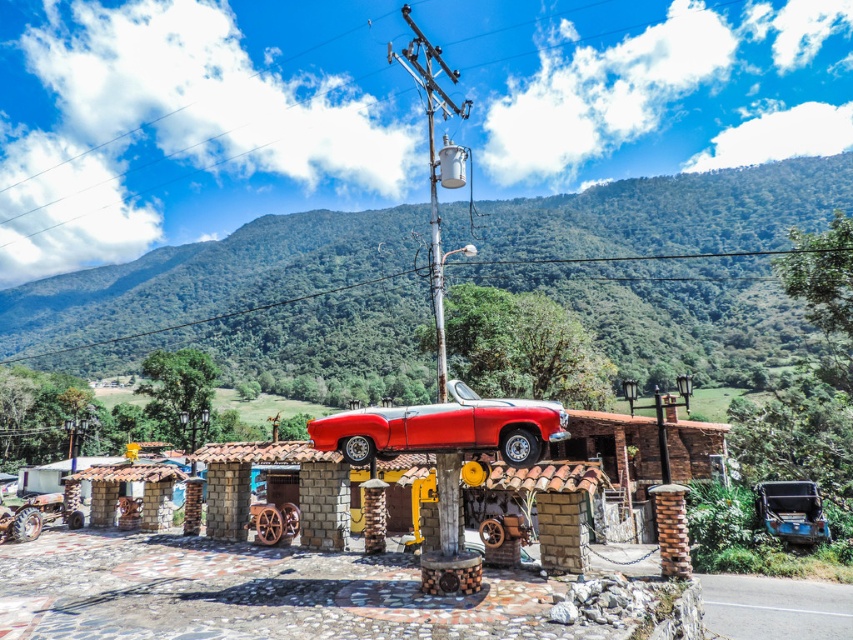
Can you confirm if metallic pole at upper center is taller than blue metallic truck at lower right?

Indeed, metallic pole at upper center has a greater height compared to blue metallic truck at lower right.

Which is below, metallic pole at upper center or blue metallic truck at lower right?

blue metallic truck at lower right is lower down.

Which is in front, point (790, 250) or point (782, 529)?

Point (782, 529) is more forward.

I want to click on metallic pole at upper center, so click(x=213, y=316).

Who is positioned more to the left, shiny red car at center or brown stone pillar at center?

shiny red car at center

Is the position of shiny red car at center less distant than that of brown stone pillar at center?

Yes, it is.

Is point (520, 436) positioned in front of point (682, 573)?

Yes, point (520, 436) is in front of point (682, 573).

Image resolution: width=853 pixels, height=640 pixels. What are the coordinates of `shiny red car at center` in the screenshot? It's located at (444, 428).

Is blue metallic truck at lower right positioned at the back of metallic gray transformer at upper center?

That is True.

Is point (792, 484) positioned after point (451, 172)?

Yes, point (792, 484) is behind point (451, 172).

The height and width of the screenshot is (640, 853). What do you see at coordinates (791, 509) in the screenshot? I see `blue metallic truck at lower right` at bounding box center [791, 509].

Locate an element on the screen. The width and height of the screenshot is (853, 640). blue metallic truck at lower right is located at coordinates (791, 509).